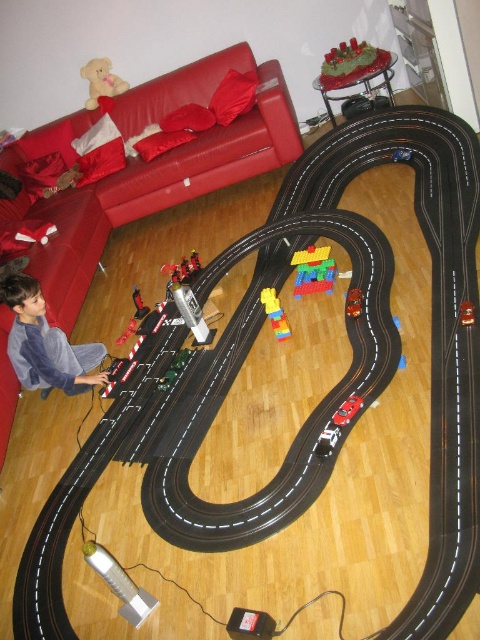
Question: Which object is positioned closest to the shiny red car at center?

Choices:
 (A) translucent plastic car at center
 (B) bright yellow plastic toy at center
 (C) metallic silver remote control car at lower left

Answer: (A)

Question: Which point appears farthest from the camera in this image?

Choices:
 (A) (121, 337)
 (B) (393, 316)
 (C) (103, 56)

Answer: (C)

Question: Does multicolored plastic blocks at center appear on the left side of shiny red car at center?

Choices:
 (A) yes
 (B) no

Answer: (A)

Question: Based on their relative distances, which object is nearer to the green velvet cake at upper center?

Choices:
 (A) metallic silver remote control car at lower left
 (B) gray cotton shirt at lower left

Answer: (A)

Question: Is gray cotton shirt at lower left smaller than green velvet cake at upper center?

Choices:
 (A) no
 (B) yes

Answer: (A)

Question: Does green velvet cake at upper center appear over blue plastic car at center?

Choices:
 (A) yes
 (B) no

Answer: (A)